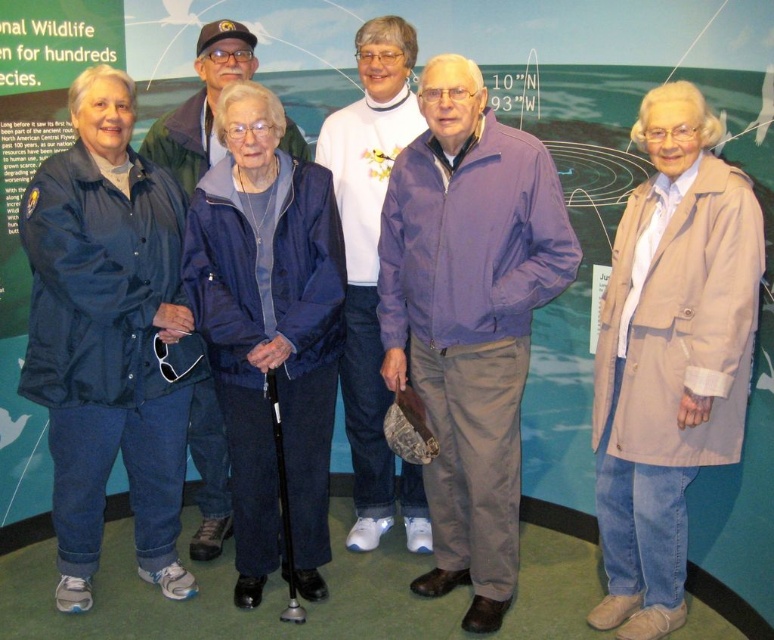
Is white matte sweater at center closer to camera compared to brushed metal jacket at upper left?

Yes, white matte sweater at center is closer to the viewer.

Is white matte sweater at center taller than brushed metal jacket at upper left?

Correct, white matte sweater at center is much taller as brushed metal jacket at upper left.

Between point (361, 108) and point (296, 150), which one is positioned behind?

The point (296, 150) is more distant.

The width and height of the screenshot is (774, 640). Identify the location of white matte sweater at center. (372, 273).

Does point (502, 465) come behind point (228, 524)?

No, (502, 465) is in front of (228, 524).

Does point (464, 509) lie in front of point (218, 516)?

Yes.

This screenshot has width=774, height=640. I want to click on purple fabric jacket at center, so click(x=468, y=317).

Does matte blue jacket at left have a lesser height compared to white matte sweater at center?

Yes, matte blue jacket at left is shorter than white matte sweater at center.

Can you confirm if matte blue jacket at left is taller than white matte sweater at center?

No.

Who is more distant from viewer, (80, 288) or (387, 106)?

Positioned behind is point (387, 106).

This screenshot has height=640, width=774. I want to click on matte blue jacket at left, so click(x=108, y=337).